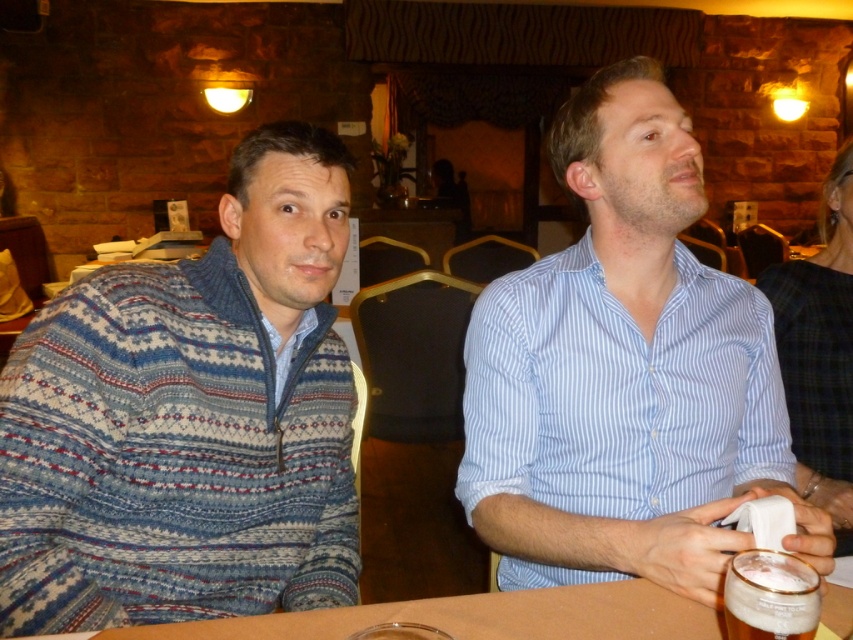
You are a bartender who needs to place a new order of drinks on the table. Considering the height of the brown wooden table at center and the foamy white beer at lower right, will the table be able to support the drinks without them spilling?

The brown wooden table at center is not as tall as the foamy white beer at lower right, which means the table is shorter than the beer. Since the table is shorter, placing drinks on it might cause them to spill over the edge. Therefore, the table may not be suitable for placing the new order of drinks without risking spills.

You are a photographer trying to capture both the knitted sweater at left and the blue striped shirt at center in a single frame. Based on their positions, which one would appear closer to the camera?

The knitted sweater at left is positioned under the blue striped shirt at center, so it would appear closer to the camera.

You are a photographer trying to capture a closeup of both the knitted sweater at left and the blue striped shirt at center. Given that your camera can only focus on objects within 12 inches of each other, will you be able to take the photo without moving either subject?

The knitted sweater at left is 14.16 inches away from the blue striped shirt at center. Since the distance between them exceeds the camera focus range of 12 inches, the photographer cannot take the photo without moving the subjects closer together.